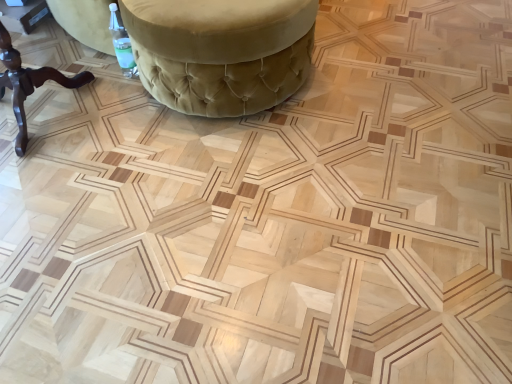
Describe the element at coordinates (28, 83) in the screenshot. I see `brown wooden table at left, the 2th furniture viewed from the right` at that location.

Identify the location of brown wooden table at left, the 2th furniture viewed from the right. (28, 83).

Identify the location of velvet green ottoman at upper center, marked as the second furniture in a left-to-right arrangement. (221, 52).

Describe the element at coordinates (221, 52) in the screenshot. I see `velvet green ottoman at upper center, acting as the 1th furniture starting from the right` at that location.

This screenshot has height=384, width=512. What are the coordinates of `brown wooden table at left, the 1th furniture in the left-to-right sequence` in the screenshot? It's located at (28, 83).

Is velvet green ottoman at upper center, acting as the 1th furniture starting from the right, to the left of brown wooden table at left, the 2th furniture viewed from the right, from the viewer's perspective?

No, velvet green ottoman at upper center, acting as the 1th furniture starting from the right, is not to the left of brown wooden table at left, the 2th furniture viewed from the right.

Which object is further away from the camera taking this photo, velvet green ottoman at upper center, marked as the second furniture in a left-to-right arrangement, or brown wooden table at left, the 2th furniture viewed from the right?

velvet green ottoman at upper center, marked as the second furniture in a left-to-right arrangement, is further from the camera.

Is point (217, 30) behind point (12, 68)?

No, (217, 30) is in front of (12, 68).

From the image's perspective, is velvet green ottoman at upper center, acting as the 1th furniture starting from the right, located above or below brown wooden table at left, the 1th furniture in the left-to-right sequence?

From the image's perspective, velvet green ottoman at upper center, acting as the 1th furniture starting from the right, appears above brown wooden table at left, the 1th furniture in the left-to-right sequence.

From a real-world perspective, is velvet green ottoman at upper center, marked as the second furniture in a left-to-right arrangement, located beneath brown wooden table at left, the 2th furniture viewed from the right?

Correct, in the physical world, velvet green ottoman at upper center, marked as the second furniture in a left-to-right arrangement, is lower than brown wooden table at left, the 2th furniture viewed from the right.

In the scene shown: Does velvet green ottoman at upper center, acting as the 1th furniture starting from the right, have a lesser width compared to brown wooden table at left, the 2th furniture viewed from the right?

No.

Considering the relative sizes of velvet green ottoman at upper center, acting as the 1th furniture starting from the right, and brown wooden table at left, the 1th furniture in the left-to-right sequence, in the image provided, is velvet green ottoman at upper center, acting as the 1th furniture starting from the right, taller than brown wooden table at left, the 1th furniture in the left-to-right sequence,?

No.

Does velvet green ottoman at upper center, acting as the 1th furniture starting from the right, have a larger size compared to brown wooden table at left, the 2th furniture viewed from the right?

Yes.

Can we say velvet green ottoman at upper center, marked as the second furniture in a left-to-right arrangement, lies outside brown wooden table at left, the 1th furniture in the left-to-right sequence?

Absolutely, velvet green ottoman at upper center, marked as the second furniture in a left-to-right arrangement, is external to brown wooden table at left, the 1th furniture in the left-to-right sequence.

Consider the image. Are velvet green ottoman at upper center, acting as the 1th furniture starting from the right, and brown wooden table at left, the 1th furniture in the left-to-right sequence, beside each other?

No, velvet green ottoman at upper center, acting as the 1th furniture starting from the right, is not beside brown wooden table at left, the 1th furniture in the left-to-right sequence.

Is velvet green ottoman at upper center, marked as the second furniture in a left-to-right arrangement, facing towards brown wooden table at left, the 1th furniture in the left-to-right sequence?

No, velvet green ottoman at upper center, marked as the second furniture in a left-to-right arrangement, is not facing towards brown wooden table at left, the 1th furniture in the left-to-right sequence.

The width and height of the screenshot is (512, 384). I want to click on furniture behind the brown wooden table at left, the 2th furniture viewed from the right, so click(221, 52).

Which object is positioned more to the left, brown wooden table at left, the 2th furniture viewed from the right, or velvet green ottoman at upper center, acting as the 1th furniture starting from the right?

brown wooden table at left, the 2th furniture viewed from the right.

Considering their positions, is brown wooden table at left, the 1th furniture in the left-to-right sequence, located in front of or behind velvet green ottoman at upper center, acting as the 1th furniture starting from the right?

Visually, brown wooden table at left, the 1th furniture in the left-to-right sequence, is located in front of velvet green ottoman at upper center, acting as the 1th furniture starting from the right.

Is point (54, 73) closer to viewer compared to point (154, 87)?

No, (54, 73) is behind (154, 87).

From the image's perspective, is brown wooden table at left, the 2th furniture viewed from the right, under velvet green ottoman at upper center, marked as the second furniture in a left-to-right arrangement?

Yes, from the image's perspective, brown wooden table at left, the 2th furniture viewed from the right, is below velvet green ottoman at upper center, marked as the second furniture in a left-to-right arrangement.

From a real-world perspective, is brown wooden table at left, the 1th furniture in the left-to-right sequence, below velvet green ottoman at upper center, acting as the 1th furniture starting from the right?

No, from a real-world perspective, brown wooden table at left, the 1th furniture in the left-to-right sequence, is not below velvet green ottoman at upper center, acting as the 1th furniture starting from the right.

Looking at this image, in terms of width, does brown wooden table at left, the 2th furniture viewed from the right, look wider or thinner when compared to velvet green ottoman at upper center, marked as the second furniture in a left-to-right arrangement?

In the image, brown wooden table at left, the 2th furniture viewed from the right, appears to be more narrow than velvet green ottoman at upper center, marked as the second furniture in a left-to-right arrangement.

Is brown wooden table at left, the 2th furniture viewed from the right, taller than velvet green ottoman at upper center, marked as the second furniture in a left-to-right arrangement?

Correct, brown wooden table at left, the 2th furniture viewed from the right, is much taller as velvet green ottoman at upper center, marked as the second furniture in a left-to-right arrangement.

Can you confirm if brown wooden table at left, the 2th furniture viewed from the right, is smaller than velvet green ottoman at upper center, acting as the 1th furniture starting from the right?

Correct, brown wooden table at left, the 2th furniture viewed from the right, occupies less space than velvet green ottoman at upper center, acting as the 1th furniture starting from the right.

Would you say brown wooden table at left, the 2th furniture viewed from the right, contains velvet green ottoman at upper center, acting as the 1th furniture starting from the right?

No, velvet green ottoman at upper center, acting as the 1th furniture starting from the right, is located outside of brown wooden table at left, the 2th furniture viewed from the right.

Is brown wooden table at left, the 2th furniture viewed from the right, touching velvet green ottoman at upper center, acting as the 1th furniture starting from the right?

No.

Is brown wooden table at left, the 2th furniture viewed from the right, aimed at velvet green ottoman at upper center, marked as the second furniture in a left-to-right arrangement?

No, brown wooden table at left, the 2th furniture viewed from the right, is not facing towards velvet green ottoman at upper center, marked as the second furniture in a left-to-right arrangement.

Can you tell me how much brown wooden table at left, the 2th furniture viewed from the right, and velvet green ottoman at upper center, acting as the 1th furniture starting from the right, differ in facing direction?

brown wooden table at left, the 2th furniture viewed from the right, and velvet green ottoman at upper center, acting as the 1th furniture starting from the right, are facing 90 degrees away from each other.

How distant is brown wooden table at left, the 2th furniture viewed from the right, from velvet green ottoman at upper center, marked as the second furniture in a left-to-right arrangement?

They are 73.22 centimeters apart.

This screenshot has width=512, height=384. In order to click on furniture that is behind the brown wooden table at left, the 1th furniture in the left-to-right sequence in this screenshot , I will do `click(221, 52)`.

You are a GUI agent. You are given a task and a screenshot of the screen. Output one action in this format:
    pyautogui.click(x=<x>, y=<y>)
    Task: Click on the furniture on the left of velvet green ottoman at upper center, acting as the 1th furniture starting from the right
    The width and height of the screenshot is (512, 384).
    Given the screenshot: What is the action you would take?
    pyautogui.click(x=28, y=83)

This screenshot has width=512, height=384. Identify the location of furniture behind the brown wooden table at left, the 1th furniture in the left-to-right sequence. (221, 52).